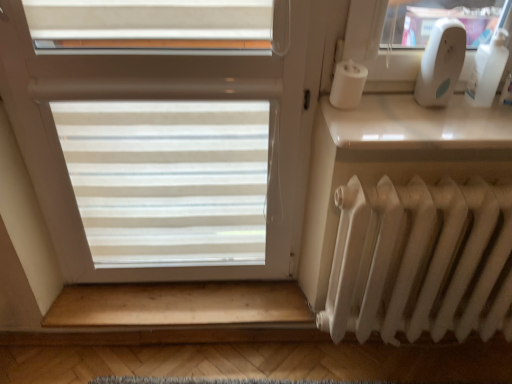
Find the location of a particular element. Image resolution: width=512 pixels, height=384 pixels. free space below white translucent blinds at center (from a real-world perspective) is located at coordinates [x=183, y=289].